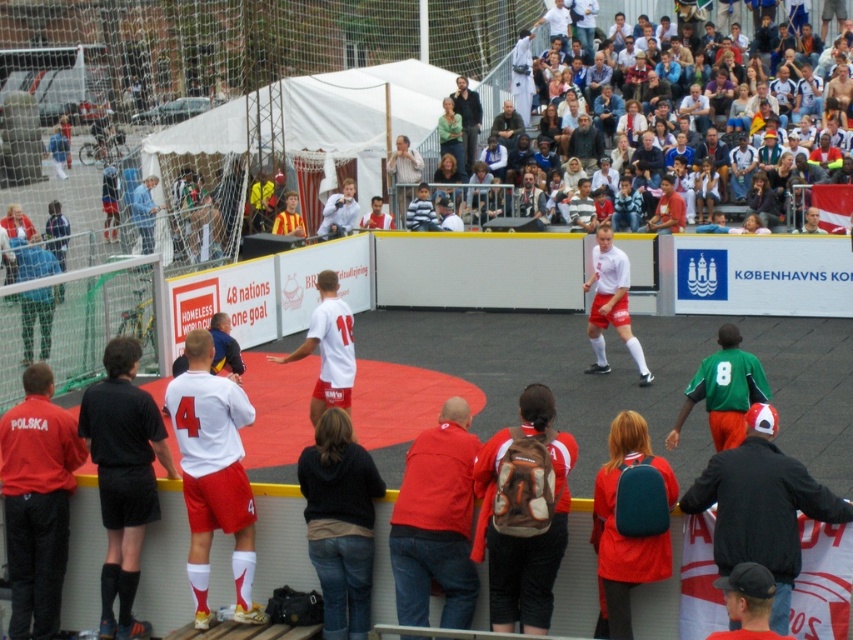
Is point (96, 419) positioned before point (440, 616)?

That is False.

Can you confirm if black matte shorts at left is positioned above red matte jacket at center?

Yes.

Is point (138, 508) positioned after point (407, 595)?

Yes, it is behind point (407, 595).

At what (x,y) coordinates should I click in order to perform the action: click on black matte shorts at left. Please return your answer as a coordinate pair (x, y). This screenshot has width=853, height=640. Looking at the image, I should click on (123, 477).

Between point (785, 612) and point (495, 131), which one is positioned behind?

The point (495, 131) is more distant.

Based on the photo, does black leather jacket at lower right have a lesser height compared to dark gray jacket at center?

No, black leather jacket at lower right is not shorter than dark gray jacket at center.

Does point (761, 445) come farther from viewer compared to point (508, 136)?

No, it is not.

Where is `black leather jacket at lower right`? black leather jacket at lower right is located at coordinates (761, 506).

Can you confirm if black leather jacket at lower right is positioned to the right of multicolored casual clothing at upper center?

Incorrect, black leather jacket at lower right is not on the right side of multicolored casual clothing at upper center.

What do you see at coordinates (761, 506) in the screenshot? I see `black leather jacket at lower right` at bounding box center [761, 506].

Is point (815, 497) positioned in front of point (434, 161)?

Yes, point (815, 497) is closer to viewer.

This screenshot has width=853, height=640. What are the coordinates of `black leather jacket at lower right` in the screenshot? It's located at (761, 506).